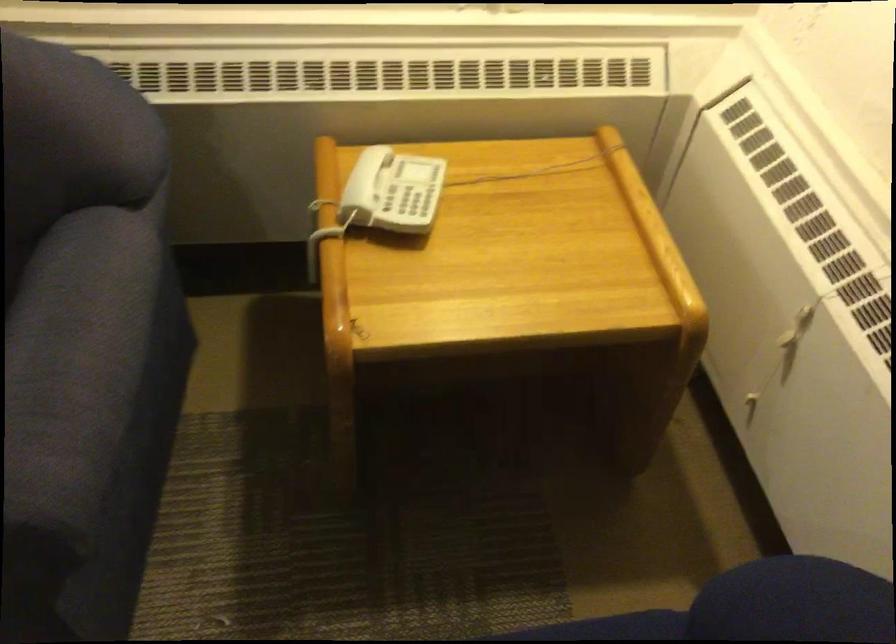
Describe the element at coordinates (82, 361) in the screenshot. I see `the blue sofa armrest` at that location.